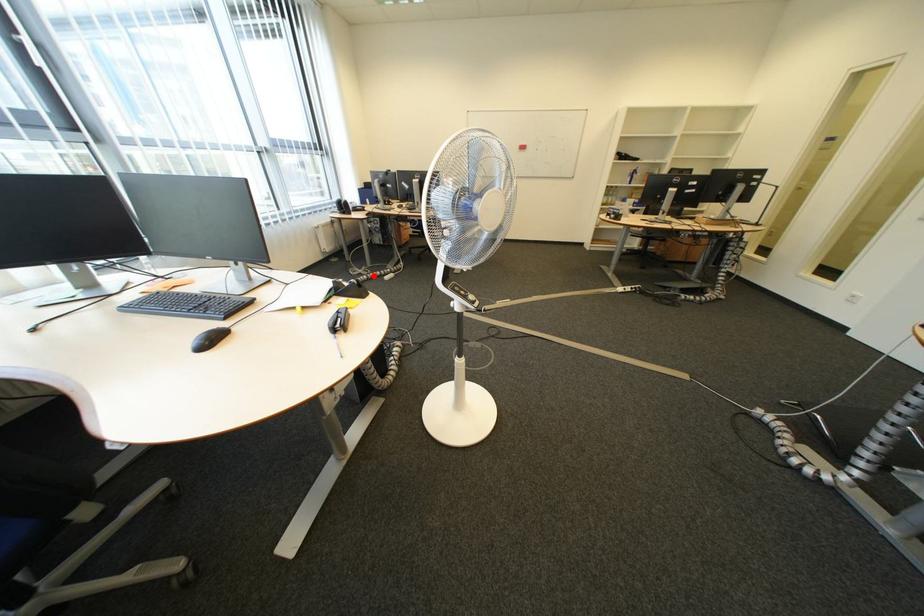
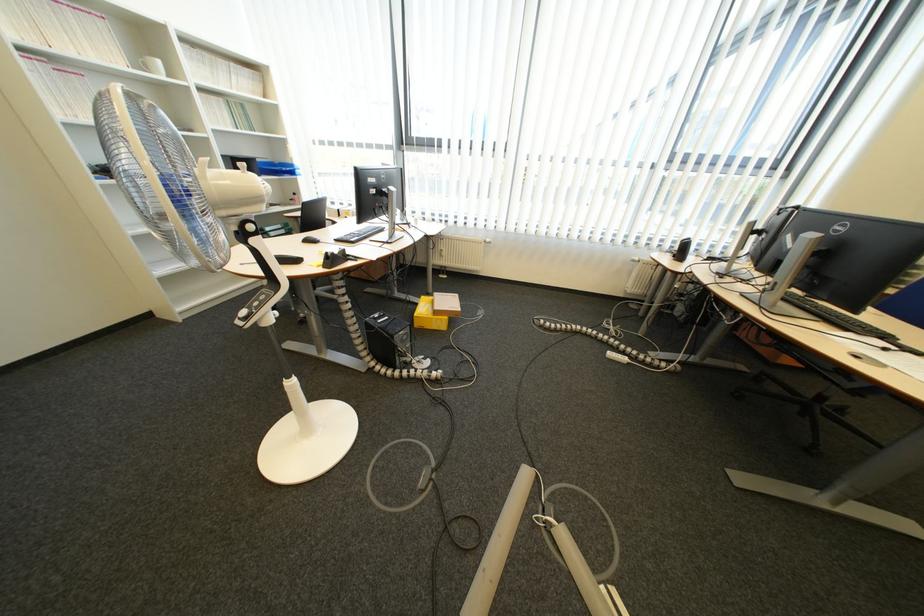
Question: I am providing you with two images of the same scene from different viewpoints. Given a red point in image1, look at the same physical point in image2. Is it:

Choices:
 (A) Closer to the viewpoint
 (B) Farther from the viewpoint

Answer: (B)